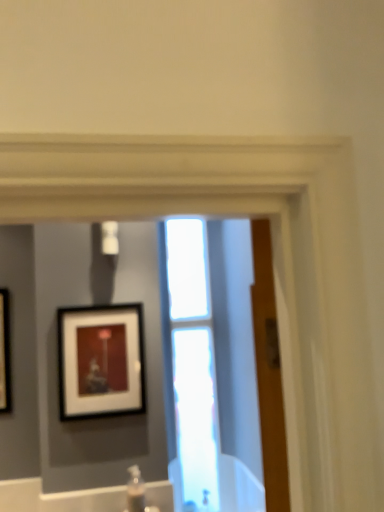
Question: Is transparent glass window at center at the left side of clear plastic bottle at lower center?

Choices:
 (A) no
 (B) yes

Answer: (A)

Question: Is transparent glass window at center smaller than clear plastic bottle at lower center?

Choices:
 (A) yes
 (B) no

Answer: (B)

Question: Considering the relative positions of transparent glass window at center and clear plastic bottle at lower center in the image provided, is transparent glass window at center to the right of clear plastic bottle at lower center from the viewer's perspective?

Choices:
 (A) no
 (B) yes

Answer: (B)

Question: From the image's perspective, would you say transparent glass window at center is shown under clear plastic bottle at lower center?

Choices:
 (A) no
 (B) yes

Answer: (A)

Question: From a real-world perspective, is transparent glass window at center positioned under clear plastic bottle at lower center based on gravity?

Choices:
 (A) yes
 (B) no

Answer: (B)

Question: Considering the relative sizes of transparent glass window at center and clear plastic bottle at lower center in the image provided, is transparent glass window at center taller than clear plastic bottle at lower center?

Choices:
 (A) no
 (B) yes

Answer: (B)

Question: From the image's perspective, is clear plastic bottle at lower center below matte black picture frame at upper left?

Choices:
 (A) no
 (B) yes

Answer: (B)

Question: Is the depth of clear plastic bottle at lower center greater than that of matte black picture frame at upper left?

Choices:
 (A) no
 (B) yes

Answer: (A)

Question: Considering the relative sizes of clear plastic bottle at lower center and matte black picture frame at upper left in the image provided, is clear plastic bottle at lower center thinner than matte black picture frame at upper left?

Choices:
 (A) no
 (B) yes

Answer: (A)

Question: From a real-world perspective, is clear plastic bottle at lower center beneath matte black picture frame at upper left?

Choices:
 (A) yes
 (B) no

Answer: (A)

Question: Is clear plastic bottle at lower center not near matte black picture frame at upper left?

Choices:
 (A) yes
 (B) no

Answer: (B)

Question: Is clear plastic bottle at lower center positioned before matte black picture frame at upper left?

Choices:
 (A) yes
 (B) no

Answer: (A)

Question: Considering the relative sizes of clear plastic bottle at lower center and transparent glass window at center in the image provided, is clear plastic bottle at lower center wider than transparent glass window at center?

Choices:
 (A) no
 (B) yes

Answer: (B)